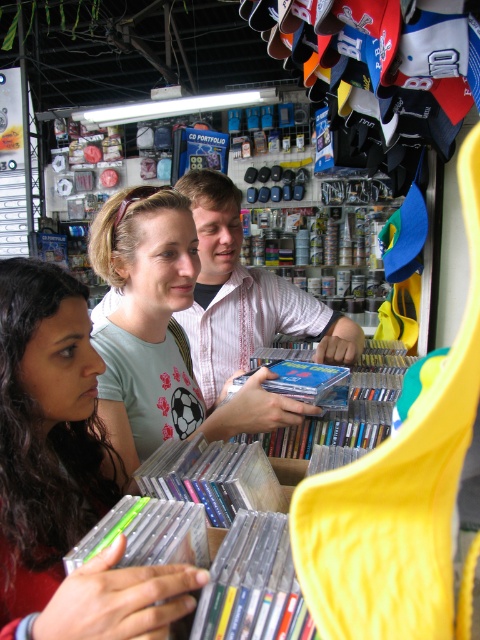
Describe the element at coordinates (63, 476) in the screenshot. I see `matte green cd case at center` at that location.

Between point (2, 273) and point (93, 339), which one is positioned in front?

Positioned in front is point (2, 273).

Does point (116, 612) come farther from viewer compared to point (186, 417)?

No.

This screenshot has width=480, height=640. Find the location of `matte green cd case at center`. matte green cd case at center is located at coordinates (63, 476).

Does matte green t-shirt at center have a greater width compared to white printed shirt at center?

In fact, matte green t-shirt at center might be narrower than white printed shirt at center.

Does matte green t-shirt at center lie behind white printed shirt at center?

No, matte green t-shirt at center is in front of white printed shirt at center.

Which is in front, point (121, 420) or point (194, 326)?

Point (121, 420) is in front.

You are a GUI agent. You are given a task and a screenshot of the screen. Output one action in this format:
    pyautogui.click(x=<x>, y=<y>)
    Task: Click on the matte green t-shirt at center
    This screenshot has height=640, width=480.
    Given the screenshot: What is the action you would take?
    pyautogui.click(x=159, y=332)

Is matte green cd case at center shorter than white printed shirt at center?

Yes, matte green cd case at center is shorter than white printed shirt at center.

Which is in front, point (67, 333) or point (356, 342)?

Point (67, 333)

Who is more distant from viewer, (152, 573) or (183, 330)?

The point (183, 330) is behind.

In order to click on matte green cd case at center in this screenshot , I will do `click(63, 476)`.